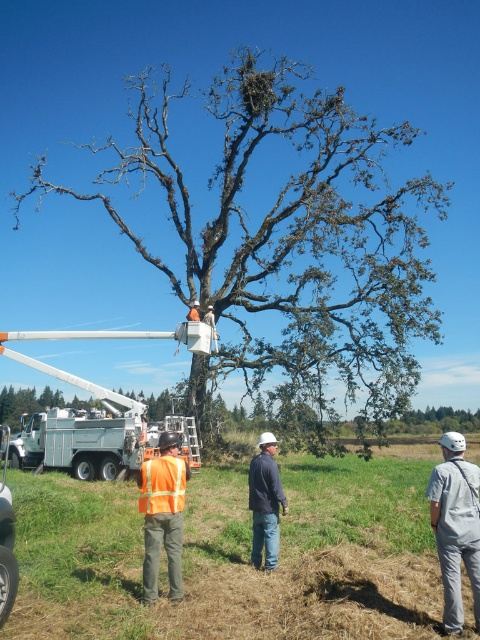
Does point (470, 588) come in front of point (256, 541)?

Yes, point (470, 588) is in front of point (256, 541).

Is gray fabric backpack at lower right behind dark blue jeans at center?

No, gray fabric backpack at lower right is in front of dark blue jeans at center.

Locate an element on the screen. gray fabric backpack at lower right is located at coordinates (456, 525).

Identify the location of gray fabric backpack at lower right. The image size is (480, 640). (456, 525).

The image size is (480, 640). What do you see at coordinates (456, 525) in the screenshot? I see `gray fabric backpack at lower right` at bounding box center [456, 525].

Does gray fabric backpack at lower right have a larger size compared to reflective orange vest at center?

Indeed, gray fabric backpack at lower right has a larger size compared to reflective orange vest at center.

Which is behind, point (452, 467) or point (179, 595)?

The point (179, 595) is more distant.

You are a GUI agent. You are given a task and a screenshot of the screen. Output one action in this format:
    pyautogui.click(x=<x>, y=<y>)
    Task: Click on the gray fabric backpack at lower right
    Image resolution: width=480 pixels, height=640 pixels.
    Given the screenshot: What is the action you would take?
    pyautogui.click(x=456, y=525)

Is white metallic trailer truck at lower left wider than dark blue jeans at center?

Indeed, white metallic trailer truck at lower left has a greater width compared to dark blue jeans at center.

Who is lower down, white metallic trailer truck at lower left or dark blue jeans at center?

Positioned lower is white metallic trailer truck at lower left.

Who is more forward, (134, 465) or (259, 481)?

Positioned in front is point (259, 481).

The height and width of the screenshot is (640, 480). Find the location of `white metallic trailer truck at lower left`. white metallic trailer truck at lower left is located at coordinates (80, 444).